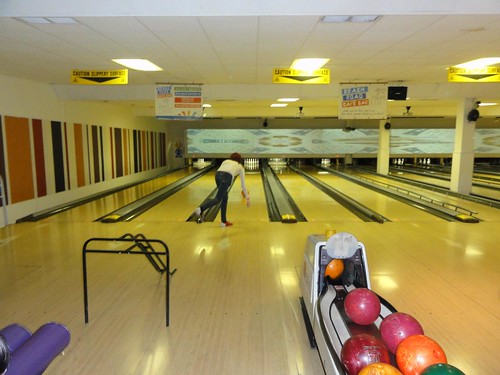
Identify the location of overhead lights. Image resolution: width=500 pixels, height=375 pixels. (132, 64), (302, 66), (481, 62), (485, 103), (392, 99), (283, 97), (281, 103), (208, 103).